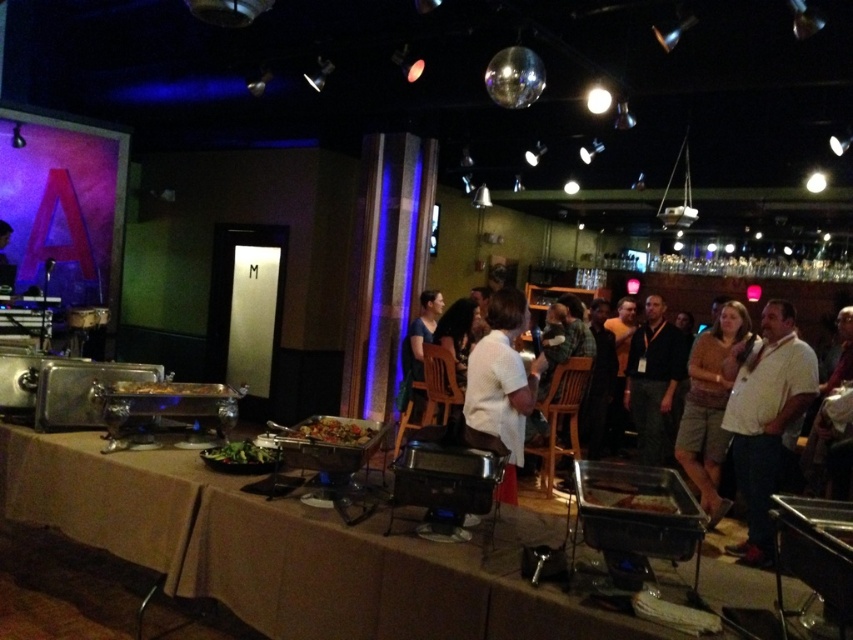
Does white shirt at center have a greater height compared to brown cotton shirt at center?

Yes.

Find the location of a particular element. Image resolution: width=853 pixels, height=640 pixels. white shirt at center is located at coordinates click(x=763, y=413).

Between shiny metallic tray at center and brown matte food at lower center, which one has more height?

brown matte food at lower center is taller.

Can you confirm if shiny metallic tray at center is shorter than brown matte food at lower center?

Yes, shiny metallic tray at center is shorter than brown matte food at lower center.

Which is in front, point (355, 433) or point (613, 502)?

Positioned in front is point (613, 502).

Locate an element on the screen. shiny metallic tray at center is located at coordinates (334, 432).

Can you confirm if white shirt at center is positioned below green leafy salad at center?

Correct, white shirt at center is located below green leafy salad at center.

Between point (753, 552) and point (233, 461), which one is positioned behind?

Positioned behind is point (753, 552).

At what (x,y) coordinates should I click in order to perform the action: click on white shirt at center. Please return your answer as a coordinate pair (x, y). Looking at the image, I should click on (763, 413).